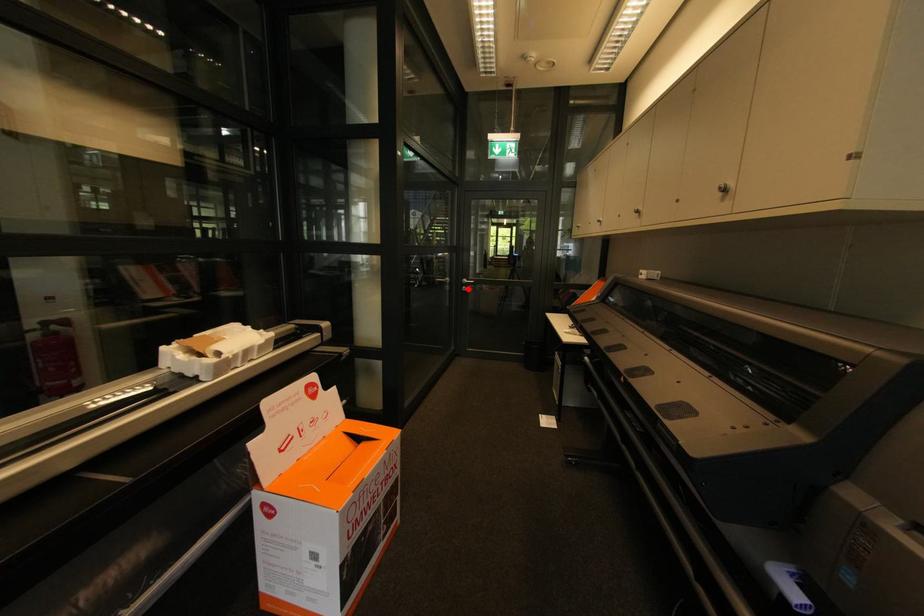
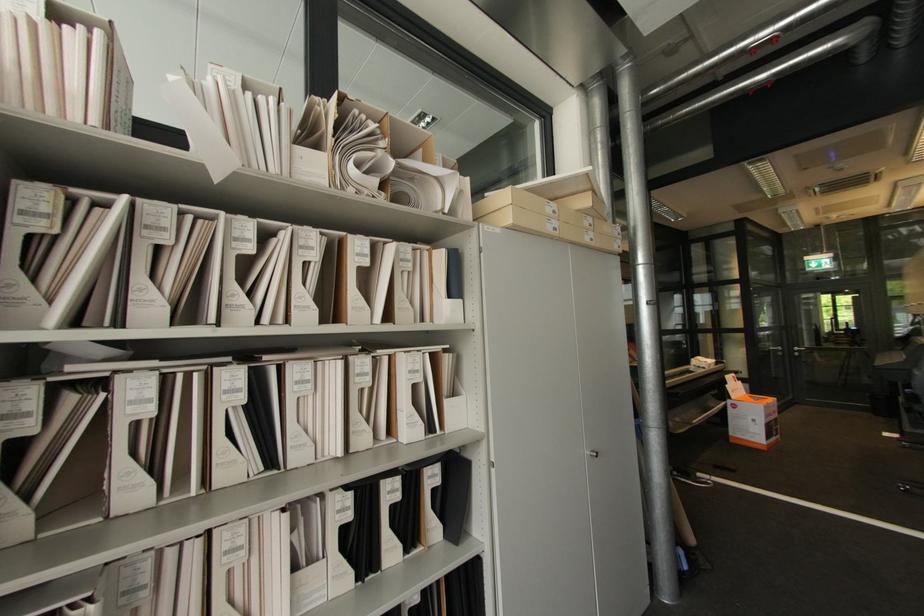
Locate, in the second image, the point that corresponds to the highlighted location in the first image.

(800, 354)